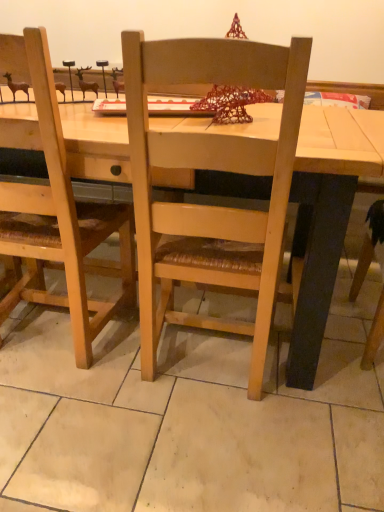
This screenshot has width=384, height=512. What do you see at coordinates (327, 214) in the screenshot?
I see `light wood table at center` at bounding box center [327, 214].

This screenshot has width=384, height=512. I want to click on light wood table at center, so click(327, 214).

I want to click on natural wood chair at center, so click(x=213, y=168).

What do you see at coordinates (213, 168) in the screenshot? I see `natural wood chair at center` at bounding box center [213, 168].

The width and height of the screenshot is (384, 512). I want to click on light wood table at center, so click(x=327, y=214).

Consider the image. Between light wood table at center and natural wood chair at center, which one appears on the left side from the viewer's perspective?

light wood table at center is more to the left.

Is the position of light wood table at center less distant than that of natural wood chair at center?

No, light wood table at center is further to the viewer.

Does point (181, 132) lie behind point (181, 48)?

Yes, it is.

From the image's perspective, which is above, light wood table at center or natural wood chair at center?

light wood table at center, from the image's perspective.

Based on the photo, from a real-world perspective, does light wood table at center stand above natural wood chair at center?

No, from a real-world perspective, light wood table at center is not on top of natural wood chair at center.

Between light wood table at center and natural wood chair at center, which one has smaller width?

natural wood chair at center.

In the scene shown: Does light wood table at center have a lesser height compared to natural wood chair at center?

Correct, light wood table at center is not as tall as natural wood chair at center.

Between light wood table at center and natural wood chair at center, which one has larger size?

Bigger between the two is light wood table at center.

Looking at this image, is natural wood chair at center surrounded by light wood table at center?

Yes, natural wood chair at center is a part of light wood table at center.

Looking at this image, would you consider light wood table at center to be distant from natural wood chair at center?

That's not correct — light wood table at center is a little close to natural wood chair at center.

Is light wood table at center positioned with its back to natural wood chair at center?

Yes.

How different are the orientations of light wood table at center and natural wood chair at center in degrees?

The angular difference between light wood table at center and natural wood chair at center is 179 degrees.

Consider the image. How distant is light wood table at center from natural wood chair at center?

light wood table at center is 9.14 inches from natural wood chair at center.

Find the location of a particular element. chair on the right side of light wood table at center is located at coordinates (213, 168).

Is natural wood chair at center at the right side of light wood table at center?

Correct, you'll find natural wood chair at center to the right of light wood table at center.

Is natural wood chair at center further to the viewer compared to light wood table at center?

That is False.

Is point (145, 188) farther from camera compared to point (320, 276)?

That is False.

From the image's perspective, which object appears higher, natural wood chair at center or light wood table at center?

light wood table at center, from the image's perspective.

From a real-world perspective, between natural wood chair at center and light wood table at center, who is vertically higher?

natural wood chair at center, from a real-world perspective.

Does natural wood chair at center have a lesser width compared to light wood table at center?

Indeed, natural wood chair at center has a lesser width compared to light wood table at center.

Does natural wood chair at center have a lesser height compared to light wood table at center?

No.

Is natural wood chair at center bigger or smaller than light wood table at center?

Considering their sizes, natural wood chair at center takes up less space than light wood table at center.

Is natural wood chair at center positioned beyond the bounds of light wood table at center?

That's incorrect, natural wood chair at center is not completely outside light wood table at center.

Is there a large distance between natural wood chair at center and light wood table at center?

natural wood chair at center is actually quite close to light wood table at center.

Is natural wood chair at center looking in the opposite direction of light wood table at center?

Absolutely, natural wood chair at center is directed away from light wood table at center.

Can you tell me how much natural wood chair at center and light wood table at center differ in facing direction?

The angular difference between natural wood chair at center and light wood table at center is 179 degrees.

Measure the distance from natural wood chair at center to light wood table at center.

The distance of natural wood chair at center from light wood table at center is 9.14 inches.

Locate an element on the screen. desk that is under the natural wood chair at center (from a real-world perspective) is located at coordinates (327, 214).

What are the coordinates of `desk above the natural wood chair at center (from the image's perspective)` in the screenshot? It's located at (327, 214).

The height and width of the screenshot is (512, 384). What are the coordinates of `chair on the right of light wood table at center` in the screenshot? It's located at (213, 168).